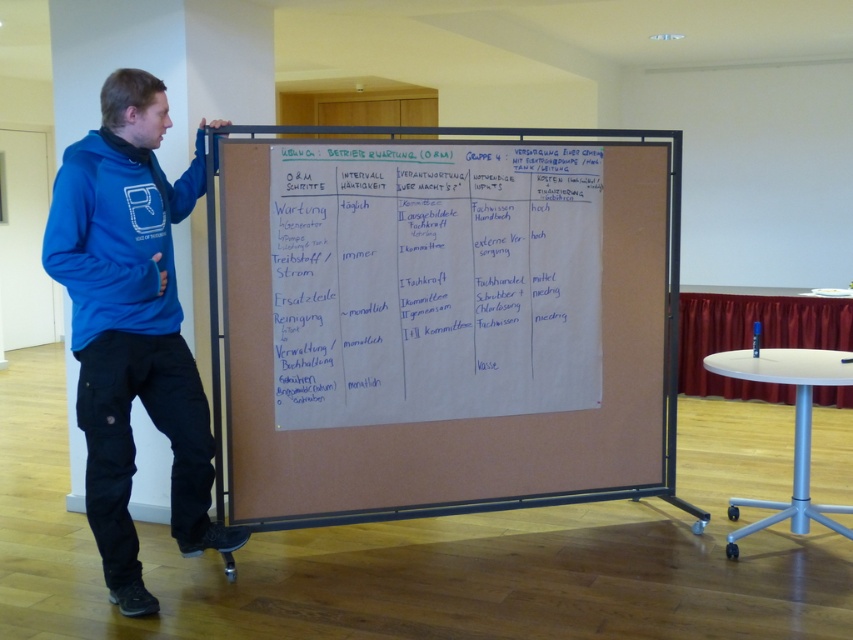
You are a tailor trying to fit a customer for a new jacket. You observe the blue cotton hoodie at left and the blue fleece sweatshirt at left in the image. Which garment should you measure first to ensure a proper fit?

You should measure the blue cotton hoodie at left first because it might be wider than the blue fleece sweatshirt at left, so understanding its dimensions will help ensure the jacket fits both garments appropriately.

In the scene shown: What is the exact coordinate of the corkboard at center?

The corkboard at center is located at point (444, 326).